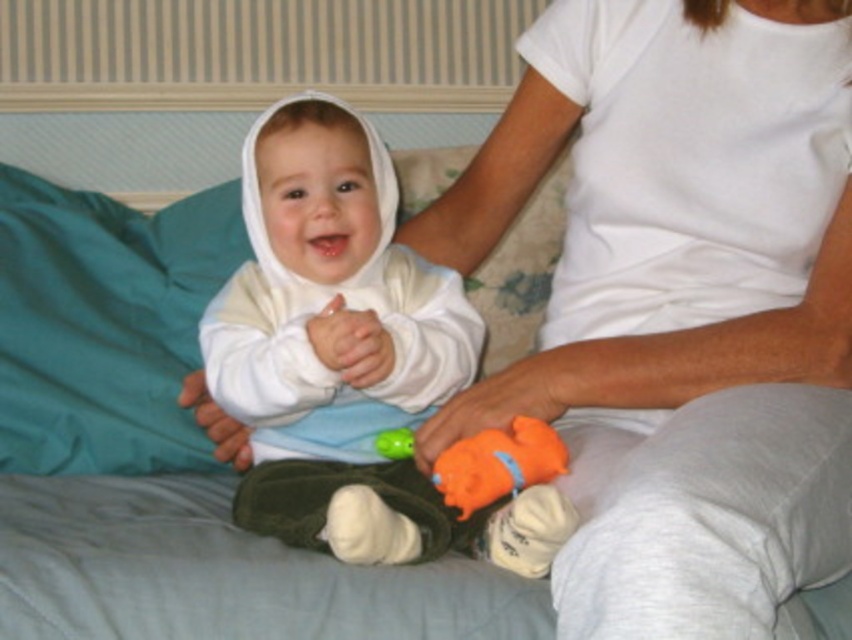
Looking at this image, you are a photographer in the room. You need to capture a photo of the white soft baby at center and the green fabric toy at center. Which object should you focus on first if you want to ensure both are in sharp focus?

The white soft baby at center is above the green fabric toy at center, so focusing on the white soft baby at center first would ensure both are in sharp focus since it is closer to the camera.

You are a photographer setting up a shoot in the bedroom scene described. You need to position a light source to the right of the orange rubber duck at lower center. Will this placement also be to the right of the white soft baby at center?

The white soft baby at center is to the left of the orange rubber duck at lower center. Positioning the light to the right of the orange rubber duck at lower center would also be to the right of the white soft baby at center since the baby is already to the left of the duck.